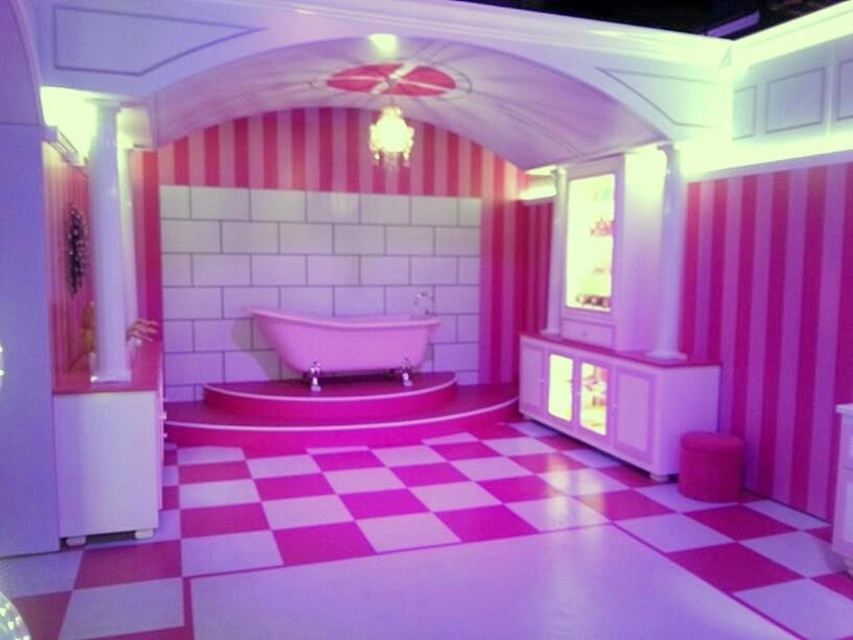
Question: Can you confirm if pink glossy bathtub at center is positioned to the right of white glossy column at left?

Choices:
 (A) no
 (B) yes

Answer: (B)

Question: Which of the following is the closest to the observer?

Choices:
 (A) white glossy pillar at upper center
 (B) pink glossy bathtub at center

Answer: (A)

Question: Is white glossy column at left positioned in front of white glossy pillar at upper center?

Choices:
 (A) no
 (B) yes

Answer: (B)

Question: Which of the following is the closest to the observer?

Choices:
 (A) white glossy pillar at upper center
 (B) white glossy column at left
 (C) pink glossy bathtub at center

Answer: (B)

Question: Which of these objects is positioned closest to the white glossy column at left?

Choices:
 (A) pink glossy bathtub at center
 (B) white glossy pillar at upper center

Answer: (A)

Question: Does white glossy column at left lie behind white glossy pillar at upper center?

Choices:
 (A) no
 (B) yes

Answer: (A)